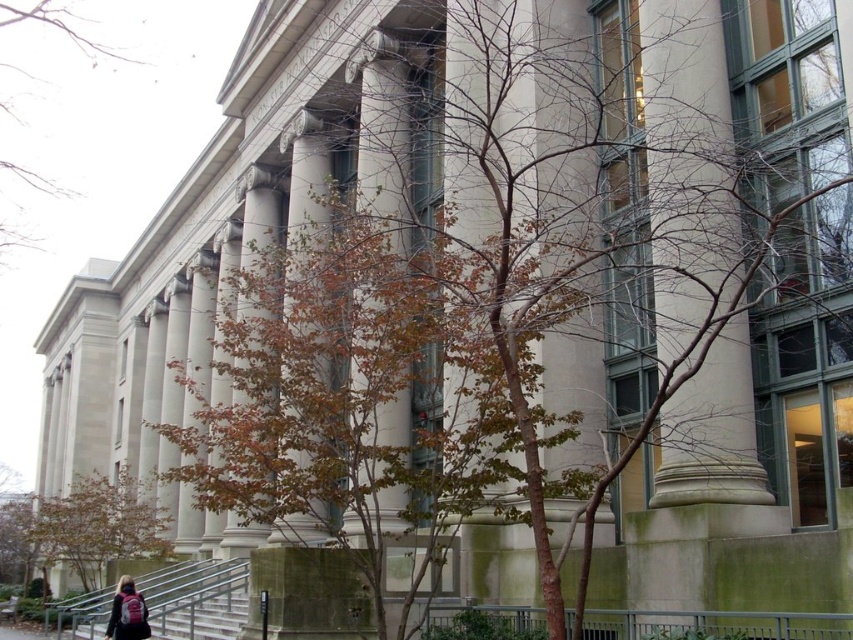
Question: Observing the image, what is the correct spatial positioning of brown leafy tree at lower left in reference to pink fabric backpack at lower left?

Choices:
 (A) above
 (B) below

Answer: (B)

Question: Is the position of brown leafy tree at lower left more distant than that of gray concrete stairs at lower left?

Choices:
 (A) yes
 (B) no

Answer: (A)

Question: Which is farther from the gray concrete stairs at lower left?

Choices:
 (A) pink fabric backpack at lower left
 (B) brown leafy tree at lower left

Answer: (B)

Question: Which point is farther to the camera?

Choices:
 (A) gray concrete stairs at lower left
 (B) brown leafy tree at upper left
 (C) pink fabric backpack at lower left

Answer: (B)

Question: Based on their relative distances, which object is farther from the pink fabric backpack at lower left?

Choices:
 (A) brown leafy tree at lower left
 (B) brown leafy tree at upper left
 (C) gray concrete stairs at lower left

Answer: (B)

Question: Is brown leafy tree at lower left to the left of pink fabric backpack at lower left from the viewer's perspective?

Choices:
 (A) no
 (B) yes

Answer: (B)